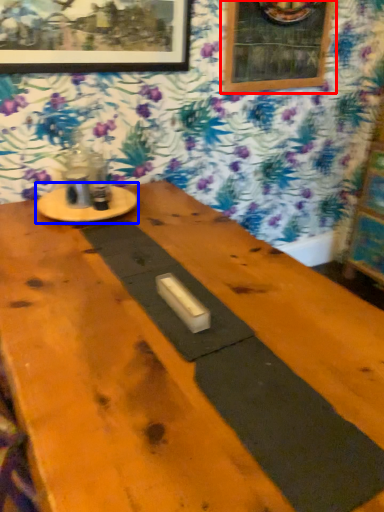
Question: Which point is closer to the camera, picture frame (highlighted by a red box) or round table (highlighted by a blue box)?

Choices:
 (A) picture frame
 (B) round table

Answer: (B)